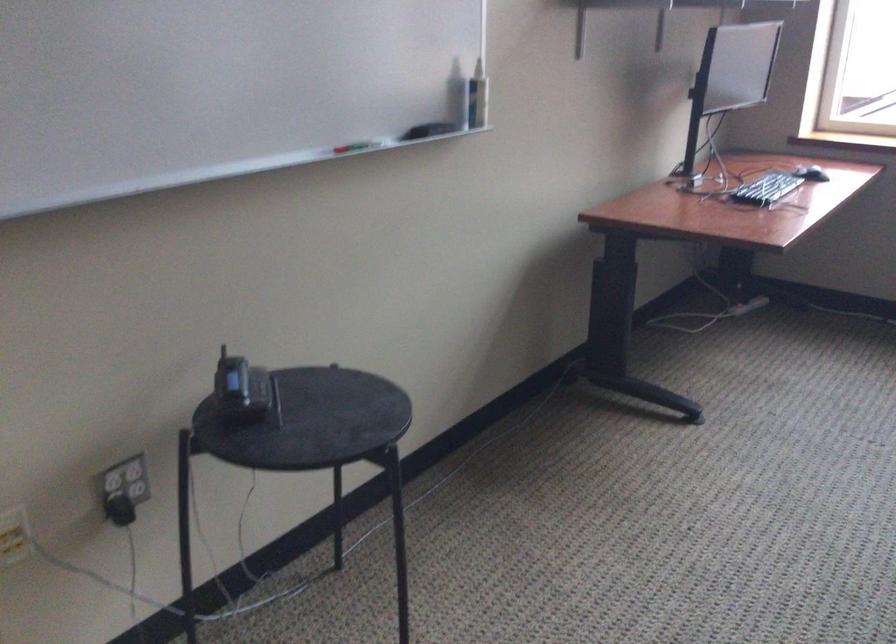
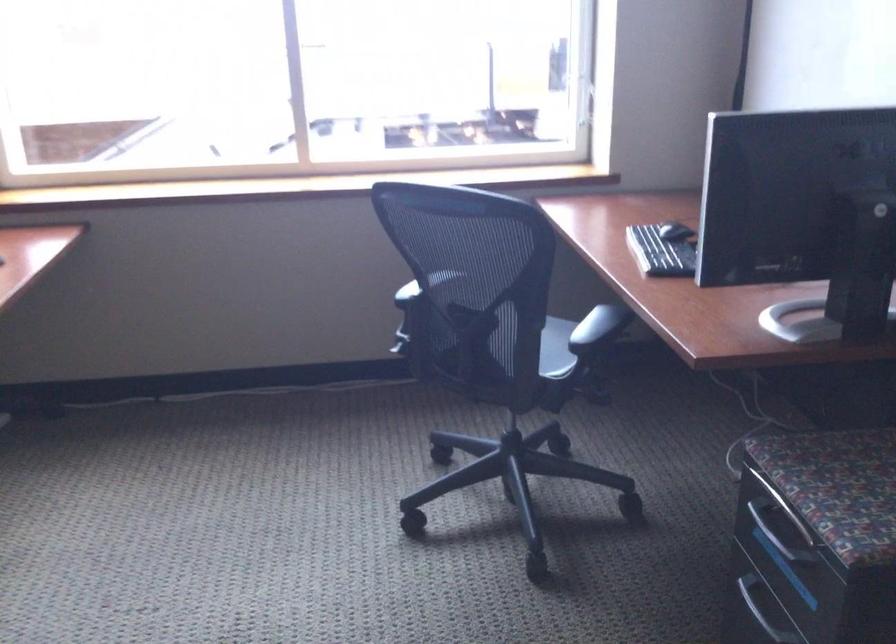
Question: The camera is either moving clockwise (left) or counter-clockwise (right) around the object. The first image is from the beginning of the video and the second image is from the end. Is the camera moving left or right when shooting the video?

Choices:
 (A) Left
 (B) Right

Answer: (A)